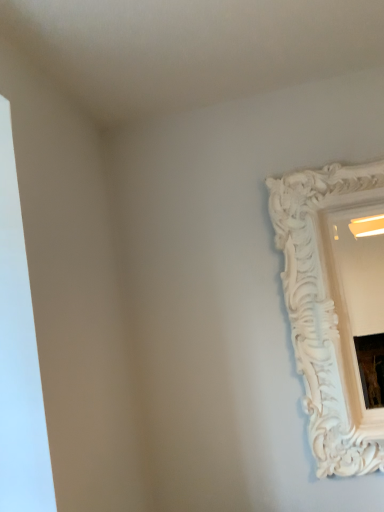
Identify the location of white carved wood picture frame at right. (336, 307).

The width and height of the screenshot is (384, 512). Describe the element at coordinates (336, 307) in the screenshot. I see `white carved wood picture frame at right` at that location.

Locate an element on the screen. The width and height of the screenshot is (384, 512). white carved wood picture frame at right is located at coordinates (336, 307).